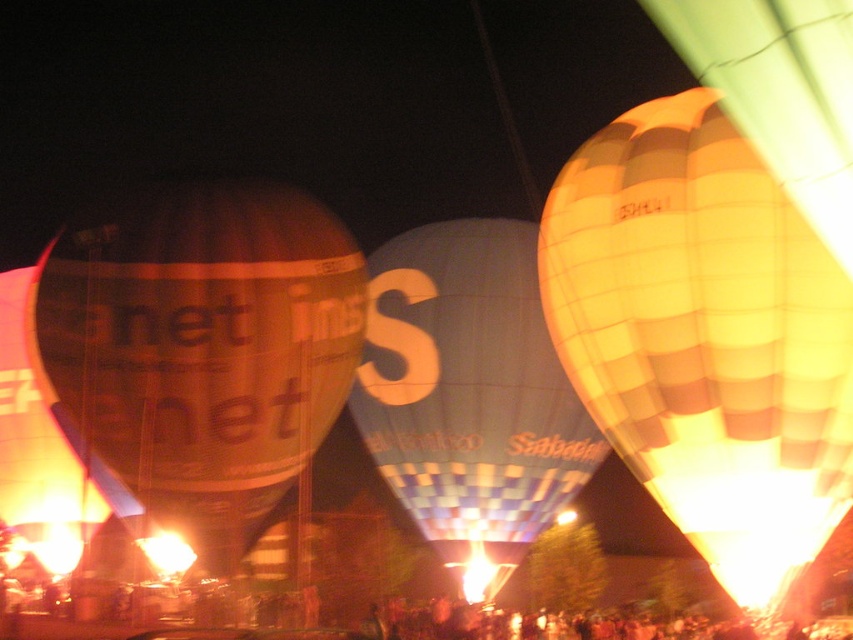
You are standing on the ground looking up at the translucent orange balloon at left. If you want to throw a small ball to hit it, will you be able to reach it?

The translucent orange balloon at left is 71.53 meters away from the viewer, which is too far for a small ball to reach.

In the scene shown: You are standing in front of the hot air balloons and want to take a photo. Which balloon should you focus on first to ensure it appears sharp in your photo, the yellow checkered balloon at right or the translucent orange balloon at left?

You should focus on the yellow checkered balloon at right first because it is closer to the viewer than the translucent orange balloon at left, making it the foreground object.